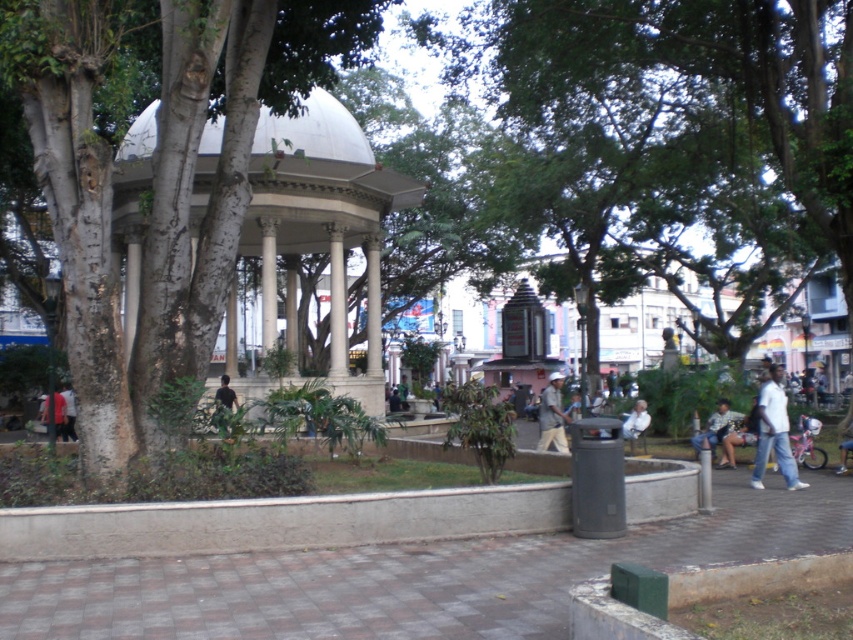
Question: Does white marble gazebo at center lie in front of light brown fabric shirt at center?

Choices:
 (A) no
 (B) yes

Answer: (B)

Question: Estimate the real-world distances between objects in this image. Which object is closer to the white marble gazebo at center?

Choices:
 (A) light brown leather jacket at lower right
 (B) white marble column at center
 (C) white fabric shirt at center

Answer: (B)

Question: Which point appears closest to the camera in this image?

Choices:
 (A) (753, 474)
 (B) (554, 435)
 (C) (647, 413)
 (D) (71, 387)

Answer: (A)

Question: Does light blue denim jeans at lower right lie in front of black matte shirt at center?

Choices:
 (A) yes
 (B) no

Answer: (B)

Question: Is light blue denim jeans at lower right bigger than white cotton shirt at lower left?

Choices:
 (A) yes
 (B) no

Answer: (B)

Question: Which of the following is the closest to the observer?

Choices:
 (A) white matte shirt at right
 (B) light brown leather jacket at lower right
 (C) black matte shirt at center
 (D) dark blue shirt at lower left

Answer: (C)